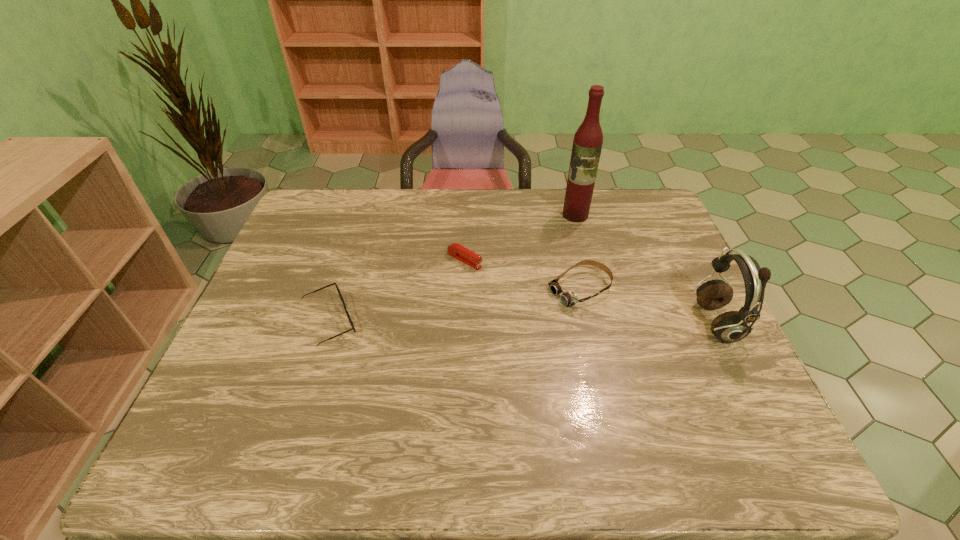
Where is `object positioned at the right edge`? This screenshot has height=540, width=960. object positioned at the right edge is located at coordinates (732, 326).

This screenshot has height=540, width=960. In order to click on vacant region at the far edge of the desktop in this screenshot , I will do `click(411, 190)`.

Locate an element on the screen. The width and height of the screenshot is (960, 540). vacant region at the near edge is located at coordinates (310, 390).

In the image, there is a desktop. Identify the location of vacant space at the left edge. The height and width of the screenshot is (540, 960). (219, 374).

You are a GUI agent. You are given a task and a screenshot of the screen. Output one action in this format:
    pyautogui.click(x=<x>, y=<y>)
    Task: Click on the vacant space at the right edge
    The width and height of the screenshot is (960, 540).
    Given the screenshot: What is the action you would take?
    pyautogui.click(x=692, y=347)

Where is `vacant space at the far left corner of the desktop`? vacant space at the far left corner of the desktop is located at coordinates (340, 212).

The image size is (960, 540). In the image, there is a desktop. In order to click on free space at the far right corner in this screenshot , I will do `click(628, 201)`.

Image resolution: width=960 pixels, height=540 pixels. I want to click on free space between the leftmost object and the goggles, so click(455, 306).

This screenshot has height=540, width=960. In order to click on free area in between the shortest object and the tallest object in this screenshot , I will do `click(520, 238)`.

Where is `vacant space that is in between the fourth object from right to left and the goggles`? Image resolution: width=960 pixels, height=540 pixels. vacant space that is in between the fourth object from right to left and the goggles is located at coordinates (522, 275).